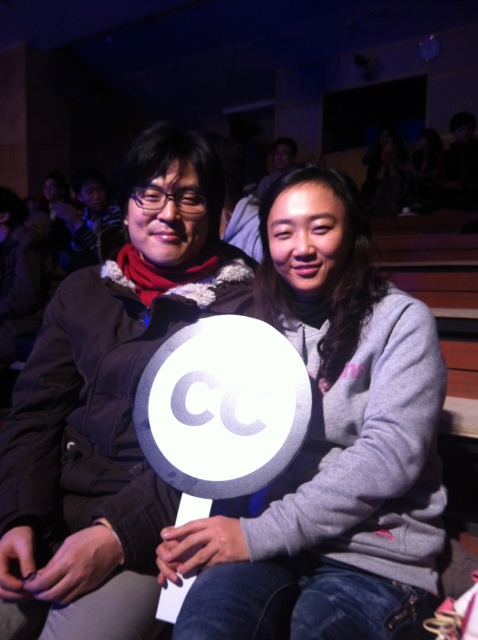
You are organizing a photo shoot and need to ensure that both the gray fleece sweatshirt at center and the white plastic sign at center are clearly visible in the frame. Given their sizes, which object should you focus on first to ensure proper lighting and composition?

The gray fleece sweatshirt at center is bigger than the white plastic sign at center, so you should focus on the gray fleece sweatshirt at center first to ensure proper lighting and composition.

In the scene shown: You are standing at the back of the auditorium and want to take a photo of the two points mentioned. Since you want to capture both points in your photo, will the point at position point [139,493] and point [206,340] be visible in the same frame?

Point point [139,493] is in front of point point [206,340], so if you are standing at the back, the point at point [139,493] will block the view of point point [206,340]. Therefore, both points may not be fully visible in the same frame.